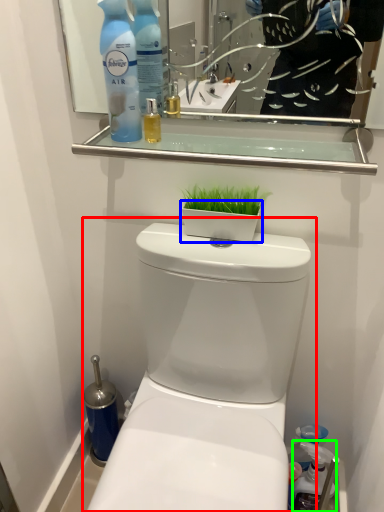
Question: Estimate the real-world distances between objects in this image. Which object is closer to toilet (highlighted by a red box), flowerpot (highlighted by a blue box) or cleaning product (highlighted by a green box)?

Choices:
 (A) flowerpot
 (B) cleaning product

Answer: (A)